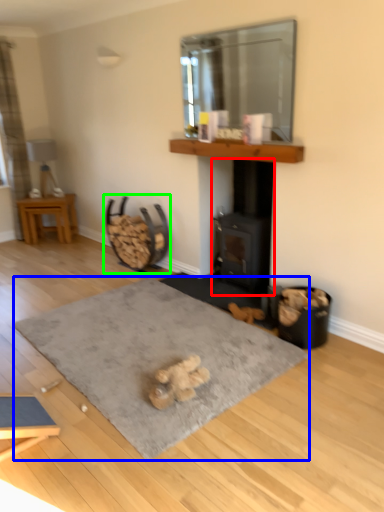
Question: Considering the real-world distances, which object is farthest from wood burning stove (highlighted by a red box)? yoga mat (highlighted by a blue box) or rocking chair (highlighted by a green box)?

Choices:
 (A) yoga mat
 (B) rocking chair

Answer: (A)